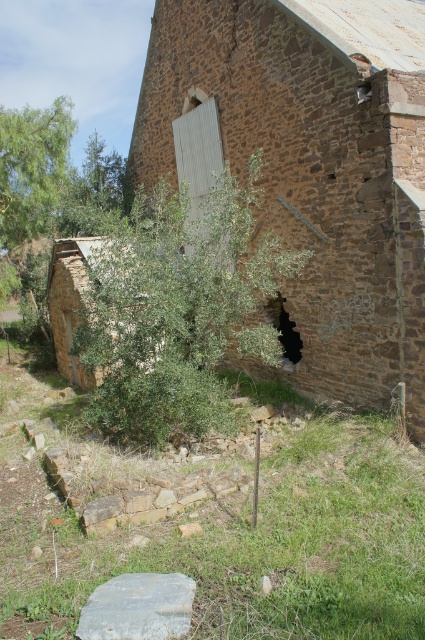
You are a gardener planning to plant a new tree between the green leafy olive tree at center and the green leafy tree at upper left. Which tree should you use as a reference for spacing to ensure the new tree is not too close to the wider tree?

The green leafy tree at upper left is wider than the green leafy olive tree at center, so you should use the green leafy tree at upper left as a reference to maintain proper spacing.

Based on the photo, you are a gardener standing in front of the brown stone wall at center and the green leafy olive tree at center. You want to plant a new tree sapling. Which location would be better for the sapling to grow without being overshadowed by the existing tree?

The brown stone wall at center is positioned over the green leafy olive tree at center, so planting the sapling near the brown stone wall at center would provide more sunlight as it is above the tree, avoiding overshadowing.